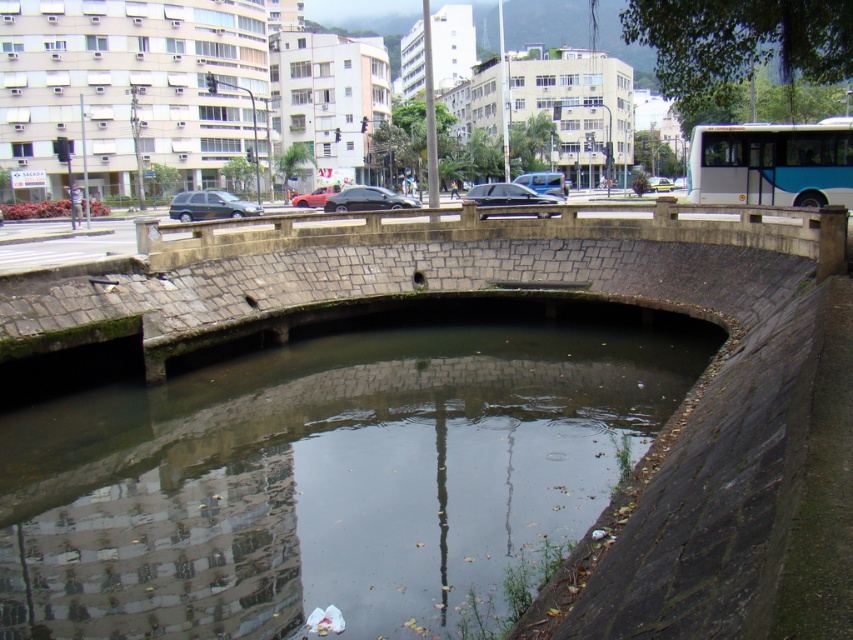
Which of these two, shiny black sedan at center or matte red car at center, stands taller?

With more height is matte red car at center.

Can you confirm if shiny black sedan at center is thinner than matte red car at center?

Incorrect, shiny black sedan at center's width is not less than matte red car at center's.

Does point (351, 204) come closer to viewer compared to point (312, 196)?

Yes.

At what (x,y) coordinates should I click in order to perform the action: click on shiny black sedan at center. Please return your answer as a coordinate pair (x, y). This screenshot has width=853, height=640. Looking at the image, I should click on (367, 198).

Is point (479, 196) more distant than point (666, 186)?

No, (479, 196) is closer to viewer.

Is shiny black car at center thinner than yellow matte car at upper right?

Indeed, shiny black car at center has a lesser width compared to yellow matte car at upper right.

Which is in front, point (480, 184) or point (659, 184)?

Point (480, 184) is more forward.

You are a GUI agent. You are given a task and a screenshot of the screen. Output one action in this format:
    pyautogui.click(x=<x>, y=<y>)
    Task: Click on the shiny black car at center
    The height and width of the screenshot is (640, 853).
    Given the screenshot: What is the action you would take?
    pyautogui.click(x=508, y=195)

Does point (235, 216) come in front of point (0, 216)?

That is True.

Looking at this image, who is shorter, metallic gray suv at center-left or matte black car at center?

matte black car at center is shorter.

Describe the element at coordinates (209, 205) in the screenshot. I see `metallic gray suv at center-left` at that location.

Where is `metallic gray suv at center-left`? This screenshot has height=640, width=853. metallic gray suv at center-left is located at coordinates (209, 205).